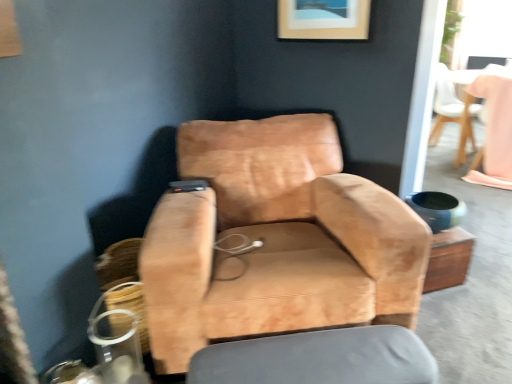
What do you see at coordinates (323, 19) in the screenshot?
I see `wooden picture frame at upper center` at bounding box center [323, 19].

Identify the location of pink fabric table at upper right. (495, 131).

Locate an element on the screen. wooden picture frame at upper center is located at coordinates (323, 19).

Do you think wooden picture frame at upper center is within light brown leather chair at upper right, acting as the first chair starting from the top, or outside of it?

wooden picture frame at upper center lies outside light brown leather chair at upper right, acting as the first chair starting from the top.

From the image's perspective, which object appears higher, wooden picture frame at upper center or light brown leather chair at upper right, positioned as the first chair in right-to-left order?

wooden picture frame at upper center appears higher in the image.

Is wooden picture frame at upper center shorter than light brown leather chair at upper right, marked as the 2th chair in a left-to-right arrangement?

Correct, wooden picture frame at upper center is not as tall as light brown leather chair at upper right, marked as the 2th chair in a left-to-right arrangement.

In the scene shown: From the image's perspective, which one is positioned lower, light brown leather chair at upper right, which is the first chair in back-to-front order, or suede tan chair at center, the first chair positioned from the front?

suede tan chair at center, the first chair positioned from the front.

The height and width of the screenshot is (384, 512). Find the location of `chair on the right side of suede tan chair at center, the first chair positioned from the front`. chair on the right side of suede tan chair at center, the first chair positioned from the front is located at coordinates (454, 107).

Consider the image. Which of these two, light brown leather chair at upper right, which ranks as the 2th chair in bottom-to-top order, or suede tan chair at center, which appears as the 1th chair when viewed from the left, stands taller?

suede tan chair at center, which appears as the 1th chair when viewed from the left.

Do you think light brown leather chair at upper right, which is the first chair in back-to-front order, is within suede tan chair at center, the first chair positioned from the front, or outside of it?

light brown leather chair at upper right, which is the first chair in back-to-front order, is spatially situated outside suede tan chair at center, the first chair positioned from the front.

Considering the points (459, 76) and (328, 343), which point is behind, point (459, 76) or point (328, 343)?

The point (459, 76) is farther from the camera.

Looking at this image, in the image, is light brown leather chair at upper right, which ranks as the 2th chair in bottom-to-top order, positioned in front of or behind smooth gray cushion at lower center?

light brown leather chair at upper right, which ranks as the 2th chair in bottom-to-top order, is positioned farther from the viewer than smooth gray cushion at lower center.

From the image's perspective, is light brown leather chair at upper right, which is the first chair in back-to-front order, under smooth gray cushion at lower center?

No.

How different are the orientations of light brown leather chair at upper right, which is the first chair in back-to-front order, and smooth gray cushion at lower center in degrees?

They differ by 48.7 degrees in their facing directions.

Which object is further away from the camera, pink fabric table at upper right or light brown leather chair at upper right, marked as the 2th chair in a left-to-right arrangement?

Positioned behind is light brown leather chair at upper right, marked as the 2th chair in a left-to-right arrangement.

Does pink fabric table at upper right have a larger size compared to light brown leather chair at upper right, which ranks as the 2th chair in bottom-to-top order?

No.

Is pink fabric table at upper right not within light brown leather chair at upper right, positioned as the first chair in right-to-left order?

Yes, pink fabric table at upper right is located beyond the bounds of light brown leather chair at upper right, positioned as the first chair in right-to-left order.

From the picture: Is suede tan chair at center, the first chair positioned from the front, positioned in front of wooden picture frame at upper center?

That is True.

Looking at this image, would you say wooden picture frame at upper center is part of suede tan chair at center, which ranks as the 1th chair in bottom-to-top order,'s contents?

Definitely not — wooden picture frame at upper center is not inside suede tan chair at center, which ranks as the 1th chair in bottom-to-top order.

Can you confirm if suede tan chair at center, the first chair positioned from the front, is bigger than wooden picture frame at upper center?

Yes, suede tan chair at center, the first chair positioned from the front, is bigger than wooden picture frame at upper center.

Is suede tan chair at center, which appears as the 1th chair when viewed from the left, positioned far away from wooden picture frame at upper center?

No, suede tan chair at center, which appears as the 1th chair when viewed from the left, is not far away from wooden picture frame at upper center.

Which point is more forward, (468, 104) or (485, 123)?

The point (485, 123) is more forward.

Is light brown leather chair at upper right, the 2th chair viewed from the front, oriented away from pink fabric table at upper right?

No.

Could you measure the distance between light brown leather chair at upper right, positioned as the first chair in right-to-left order, and pink fabric table at upper right?

12.84 inches.

Is light brown leather chair at upper right, which is the first chair in back-to-front order, bigger than pink fabric table at upper right?

Correct, light brown leather chair at upper right, which is the first chair in back-to-front order, is larger in size than pink fabric table at upper right.

Is wooden picture frame at upper center directly adjacent to suede tan chair at center, which is the second chair in back-to-front order?

No, wooden picture frame at upper center is not beside suede tan chair at center, which is the second chair in back-to-front order.

In order to click on picture frame above the suede tan chair at center, the first chair positioned from the front (from a real-world perspective) in this screenshot , I will do `click(323, 19)`.

Is wooden picture frame at upper center positioned before suede tan chair at center, which ranks as the 1th chair in bottom-to-top order?

That is False.

Is wooden picture frame at upper center oriented towards suede tan chair at center, the 2th chair from the top?

No.

Image resolution: width=512 pixels, height=384 pixels. What are the coordinates of `chair that is the 2nd object directly below the wooden picture frame at upper center (from a real-world perspective)` in the screenshot? It's located at (454, 107).

Find the location of a particular element. Image resolution: width=512 pixels, height=384 pixels. chair located behind the suede tan chair at center, the first chair positioned from the front is located at coordinates (454, 107).

When comparing their distances from pink fabric table at upper right, does smooth gray cushion at lower center or light brown leather chair at upper right, which ranks as the 2th chair in bottom-to-top order, seem closer?

light brown leather chair at upper right, which ranks as the 2th chair in bottom-to-top order.

Which object lies nearer to the anchor point suede tan chair at center, which appears as the 1th chair when viewed from the left, smooth gray cushion at lower center or wooden picture frame at upper center?

smooth gray cushion at lower center is closer to suede tan chair at center, which appears as the 1th chair when viewed from the left.

From the image, which object appears to be nearer to suede tan chair at center, the 2th chair from the top, smooth gray cushion at lower center or light brown leather chair at upper right, which ranks as the 2th chair in bottom-to-top order?

smooth gray cushion at lower center lies closer to suede tan chair at center, the 2th chair from the top, than the other object.

Estimate the real-world distances between objects in this image. Which object is closer to light brown leather chair at upper right, which is the first chair in back-to-front order, suede tan chair at center, which appears as the 1th chair when viewed from the left, or wooden picture frame at upper center?

Among the two, wooden picture frame at upper center is located nearer to light brown leather chair at upper right, which is the first chair in back-to-front order.

Based on their spatial positions, is suede tan chair at center, the 2th chair from the top, or light brown leather chair at upper right, marked as the 2th chair in a left-to-right arrangement, further from smooth gray cushion at lower center?

Among the two, light brown leather chair at upper right, marked as the 2th chair in a left-to-right arrangement, is located further to smooth gray cushion at lower center.

In the scene shown: Looking at the image, which one is located further to light brown leather chair at upper right, positioned as the first chair in right-to-left order, smooth gray cushion at lower center or wooden picture frame at upper center?

smooth gray cushion at lower center.

From the image, which object appears to be farther from pink fabric table at upper right, light brown leather chair at upper right, positioned as the first chair in right-to-left order, or wooden picture frame at upper center?

wooden picture frame at upper center lies further to pink fabric table at upper right than the other object.

Looking at the image, which one is located closer to pink fabric table at upper right, suede tan chair at center, the first chair positioned from the front, or light brown leather chair at upper right, the 2th chair viewed from the front?

light brown leather chair at upper right, the 2th chair viewed from the front.

Image resolution: width=512 pixels, height=384 pixels. In order to click on picture frame between smooth gray cushion at lower center and pink fabric table at upper right in the horizontal direction in this screenshot , I will do `click(323, 19)`.

What are the coordinates of `swivel chair between suede tan chair at center, which appears as the 2th chair when viewed from the right, and pink fabric table at upper right, in the horizontal direction` in the screenshot? It's located at (319, 358).

This screenshot has height=384, width=512. Identify the location of picture frame positioned between suede tan chair at center, which appears as the 2th chair when viewed from the right, and light brown leather chair at upper right, positioned as the first chair in right-to-left order, from near to far. (323, 19).

Where is `picture frame between smooth gray cushion at lower center and light brown leather chair at upper right, positioned as the first chair in right-to-left order, along the z-axis`? picture frame between smooth gray cushion at lower center and light brown leather chair at upper right, positioned as the first chair in right-to-left order, along the z-axis is located at coordinates (323, 19).